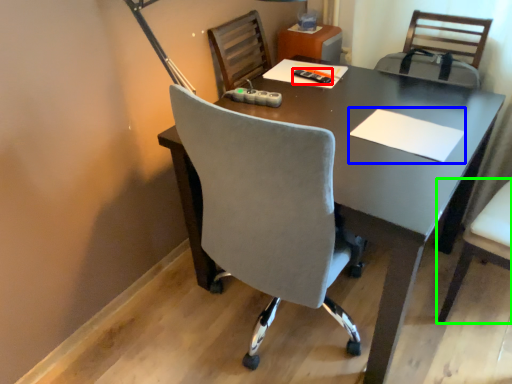
Question: Which object is positioned farthest from stationery (highlighted by a red box)? Select from notepad (highlighted by a blue box) and chair (highlighted by a green box).

Choices:
 (A) notepad
 (B) chair

Answer: (B)